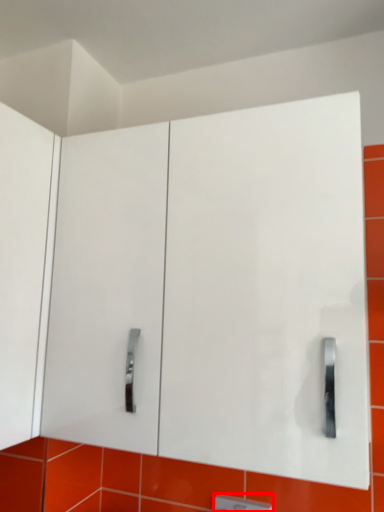
Question: From the image, what is the correct spatial relationship of light switch (annotated by the red box) in relation to glass door?

Choices:
 (A) right
 (B) left

Answer: (A)